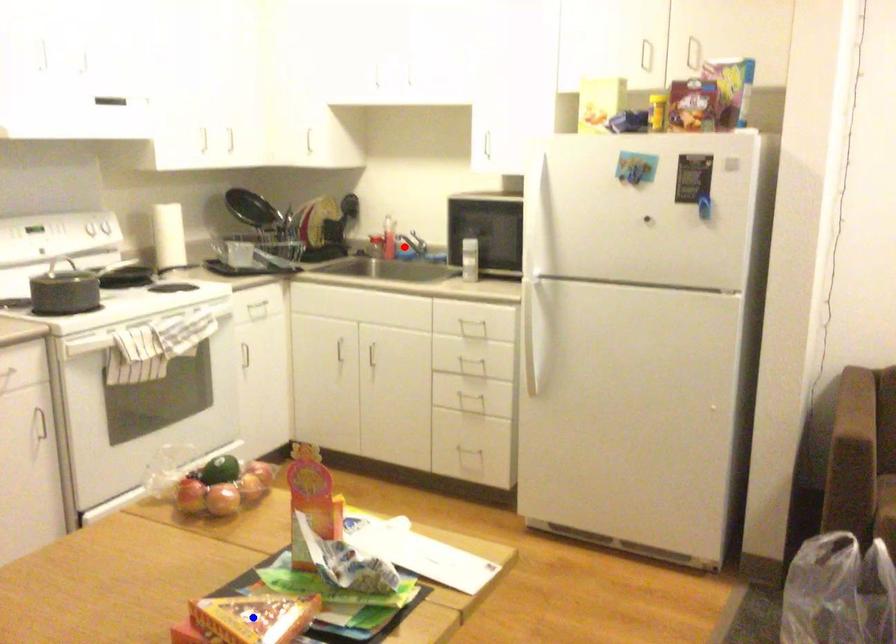
Question: In the image, two points are highlighted. Which point is nearer to the camera? Reply with the corresponding letter.

Choices:
 (A) blue point
 (B) red point

Answer: (A)